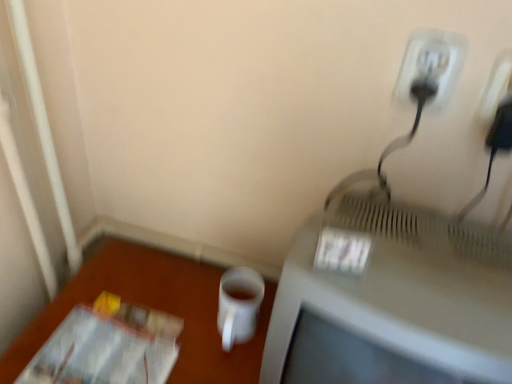
The image size is (512, 384). What are the coordinates of `transparent plastic magazine at lower left` in the screenshot? It's located at (106, 346).

The width and height of the screenshot is (512, 384). I want to click on white matte mug at lower center, so click(x=239, y=305).

The image size is (512, 384). What are the coordinates of `black plastic plug at upper right` in the screenshot? It's located at (430, 67).

In the scene shown: Are matte gray television at right and white plastic outlet at upper right far apart?

No.

From the image's perspective, who appears lower, matte gray television at right or white plastic outlet at upper right?

matte gray television at right appears lower in the image.

Between matte gray television at right and white plastic outlet at upper right, which one has larger width?

With larger width is matte gray television at right.

From a real-world perspective, is matte gray television at right beneath white plastic outlet at upper right?

Yes.

Is white plastic outlet at upper right positioned far away from matte gray television at right?

No, white plastic outlet at upper right is in close proximity to matte gray television at right.

Is white plastic outlet at upper right positioned beyond the bounds of matte gray television at right?

Yes, white plastic outlet at upper right is located beyond the bounds of matte gray television at right.

From a real-world perspective, is white plastic outlet at upper right physically below matte gray television at right?

Actually, white plastic outlet at upper right is physically above matte gray television at right in the real world.

Between white plastic outlet at upper right and matte gray television at right, which one has smaller size?

Smaller between the two is white plastic outlet at upper right.

Consider the image. Is matte gray television at right inside black plastic plug at upper right?

No.

Are black plastic plug at upper right and matte gray television at right making contact?

No, black plastic plug at upper right is not with matte gray television at right.

From the picture: Considering the sizes of objects black plastic plug at upper right and matte gray television at right in the image provided, who is shorter, black plastic plug at upper right or matte gray television at right?

black plastic plug at upper right is shorter.

From the picture: Which is behind, black plastic plug at upper right or matte gray television at right?

black plastic plug at upper right.

Does point (396, 82) come closer to viewer compared to point (112, 359)?

Yes, it is in front of point (112, 359).

Which of these two, black plastic plug at upper right or transparent plastic magazine at lower left, stands shorter?

transparent plastic magazine at lower left.

I want to click on power plugs and sockets on the right of transparent plastic magazine at lower left, so click(x=430, y=67).

Is black plastic plug at upper right oriented away from transparent plastic magazine at lower left?

That's not correct — black plastic plug at upper right is not looking away from transparent plastic magazine at lower left.

Is the surface of white matte mug at lower center in direct contact with black plastic plug at upper right?

No, white matte mug at lower center is not in contact with black plastic plug at upper right.

From the image's perspective, is white matte mug at lower center below black plastic plug at upper right?

Correct, white matte mug at lower center appears lower than black plastic plug at upper right in the image.

From a real-world perspective, is white matte mug at lower center located higher than black plastic plug at upper right?

No.

Considering the positions of objects white matte mug at lower center and black plastic plug at upper right in the image provided, who is more to the left, white matte mug at lower center or black plastic plug at upper right?

white matte mug at lower center is more to the left.

Is white matte cup at lower right thinner than matte gray television at right?

No, white matte cup at lower right is not thinner than matte gray television at right.

Is white matte cup at lower right aimed at matte gray television at right?

No, white matte cup at lower right is not aimed at matte gray television at right.

Does white matte cup at lower right have a smaller size compared to matte gray television at right?

Incorrect, white matte cup at lower right is not smaller in size than matte gray television at right.

Consider the image. Which object is closer to the camera, white matte cup at lower right or matte gray television at right?

matte gray television at right is closer to the camera.

Does transparent plastic magazine at lower left touch black plastic plug at upper right?

No, transparent plastic magazine at lower left is not next to black plastic plug at upper right.

Consider the image. Is transparent plastic magazine at lower left smaller than black plastic plug at upper right?

No.

How different are the orientations of transparent plastic magazine at lower left and black plastic plug at upper right in degrees?

There is a 0.251-degree angle between the facing directions of transparent plastic magazine at lower left and black plastic plug at upper right.

Would you say black plastic plug at upper right is part of transparent plastic magazine at lower left's contents?

No, black plastic plug at upper right is located outside of transparent plastic magazine at lower left.

You are a GUI agent. You are given a task and a screenshot of the screen. Output one action in this format:
    pyautogui.click(x=<x>, y=<y>)
    Task: Click on the television located underneath the white plastic outlet at upper right (from a real-world perspective)
    
    Given the screenshot: What is the action you would take?
    pyautogui.click(x=391, y=298)

The width and height of the screenshot is (512, 384). What are the coordinates of `television below the white plastic outlet at upper right (from the image's perspective)` in the screenshot? It's located at (391, 298).

When comparing their distances from white matte cup at lower right, does white matte mug at lower center or white plastic outlet at upper right seem closer?

Based on the image, white matte mug at lower center appears to be nearer to white matte cup at lower right.

Considering their positions, is white matte cup at lower right positioned closer to black plastic plug at upper right than white plastic outlet at upper right?

Based on the image, white plastic outlet at upper right appears to be nearer to black plastic plug at upper right.

Based on their spatial positions, is white matte mug at lower center or white plastic outlet at upper right closer to transparent plastic magazine at lower left?

white matte mug at lower center lies closer to transparent plastic magazine at lower left than the other object.

Based on their spatial positions, is white matte mug at lower center or black plastic plug at upper right further from white matte cup at lower right?

The object further to white matte cup at lower right is black plastic plug at upper right.

Based on the photo, which object lies nearer to the anchor point matte gray television at right, black plastic plug at upper right or transparent plastic magazine at lower left?

black plastic plug at upper right.

When comparing their distances from black plastic plug at upper right, does matte gray television at right or white plastic outlet at upper right seem further?

matte gray television at right lies further to black plastic plug at upper right than the other object.

Based on their spatial positions, is white plastic outlet at upper right or black plastic plug at upper right closer to transparent plastic magazine at lower left?

The object closer to transparent plastic magazine at lower left is black plastic plug at upper right.

In the scene shown: Based on their spatial positions, is matte gray television at right or white plastic outlet at upper right further from white matte cup at lower right?

The object further to white matte cup at lower right is white plastic outlet at upper right.

Identify the location of mug between white plastic outlet at upper right and matte gray television at right in the up-down direction. Image resolution: width=512 pixels, height=384 pixels. (239, 305).

Find the location of a particular element. The image size is (512, 384). mug between transparent plastic magazine at lower left and matte gray television at right in the horizontal direction is located at coordinates (239, 305).

Identify the location of table between transparent plastic magazine at lower left and white plastic outlet at upper right from left to right. (155, 308).

Image resolution: width=512 pixels, height=384 pixels. Identify the location of television between white plastic outlet at upper right and white matte cup at lower right vertically. (391, 298).